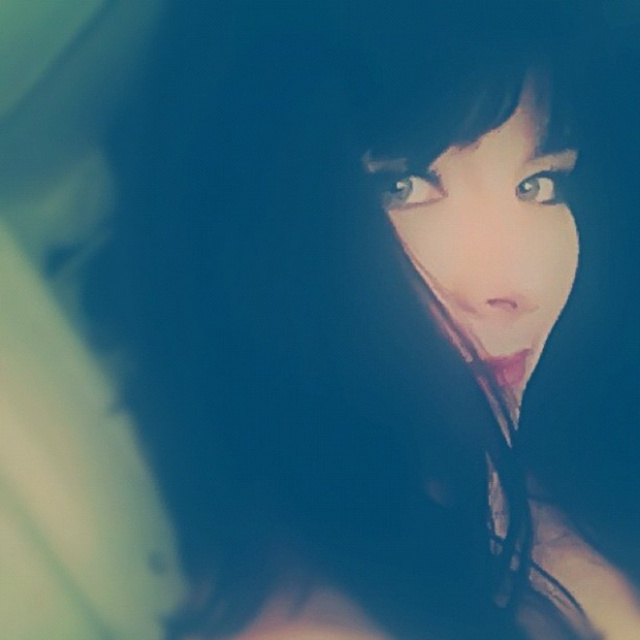
You are holding a 28 inch ruler and want to measure the distance between yourself and the point at coordinates point (404, 192) in the image. Can you reach it with your ruler?

The distance of point (404, 192) from viewer is 29.16 inches, so the ruler is 28 inches which is shorter than the distance. You cannot reach it with your ruler.

You are a photographer adjusting the lighting for a portrait. The subject has a smooth skin face at center. You need to place a highlight reflector at point (493, 236). Is this point on the subject?

Yes, the point (493, 236) corresponds to the smooth skin face at center, so placing the highlight reflector there would be appropriate.

Based on the photo, based on the scene description, which object is positioned higher in the image between the smooth skin face at center and the smooth black hair at upper center?

The smooth black hair at upper center is positioned higher than the smooth skin face at center in the image.